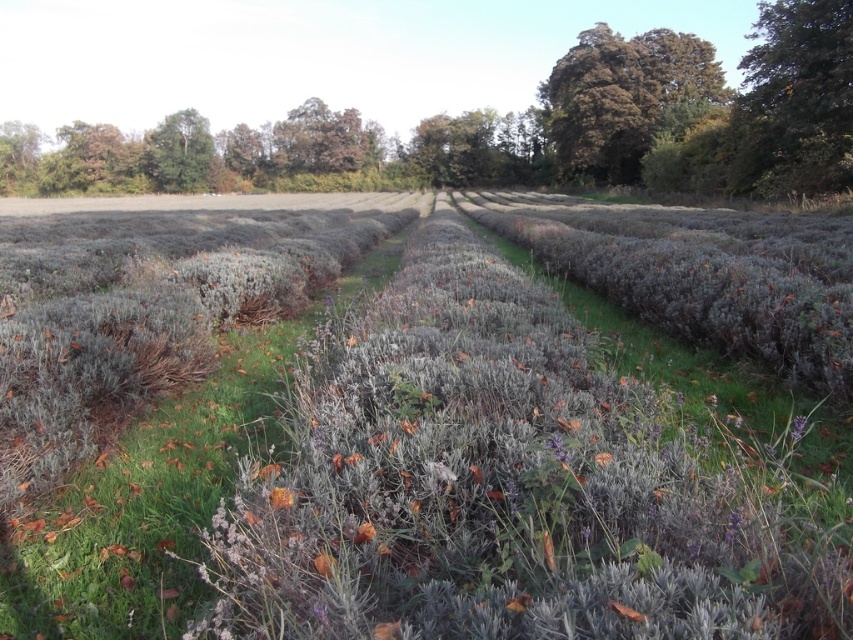
You are standing in the middle of the lavender field and want to take a photo of both the green leafy tree at upper right and the purple fuzzy flower at center. Which object should you focus on first to ensure both are in the frame?

You should focus on the green leafy tree at upper right first because it is taller than the purple fuzzy flower at center, so adjusting the camera angle to include its height will naturally include the shorter flower in the frame.

Consider the image. You are a landscape photographer planning to capture the orange matte flower at center and the brown textured tree at upper right in the same frame. Based on their positions, which object will appear closer to the camera in your photo?

The brown textured tree at upper right will appear closer to the camera because it is positioned further to the viewer than the orange matte flower at center, making it seem nearer in the photograph.